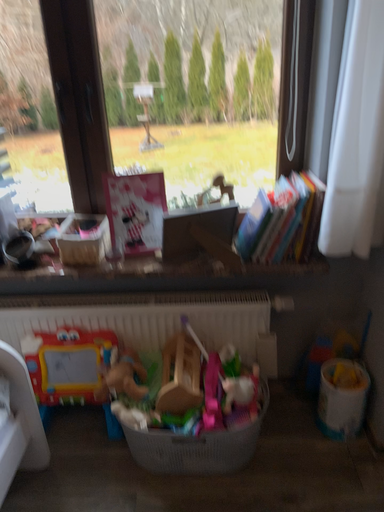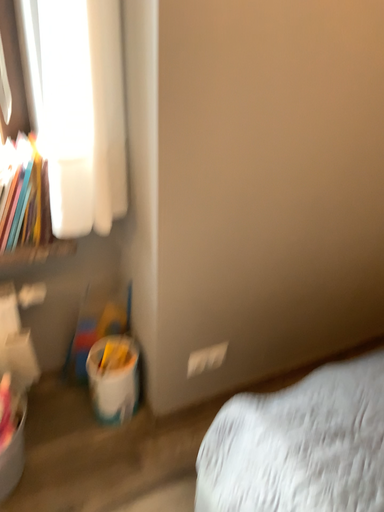
Question: How did the camera likely rotate when shooting the video?

Choices:
 (A) rotated right
 (B) rotated left

Answer: (A)